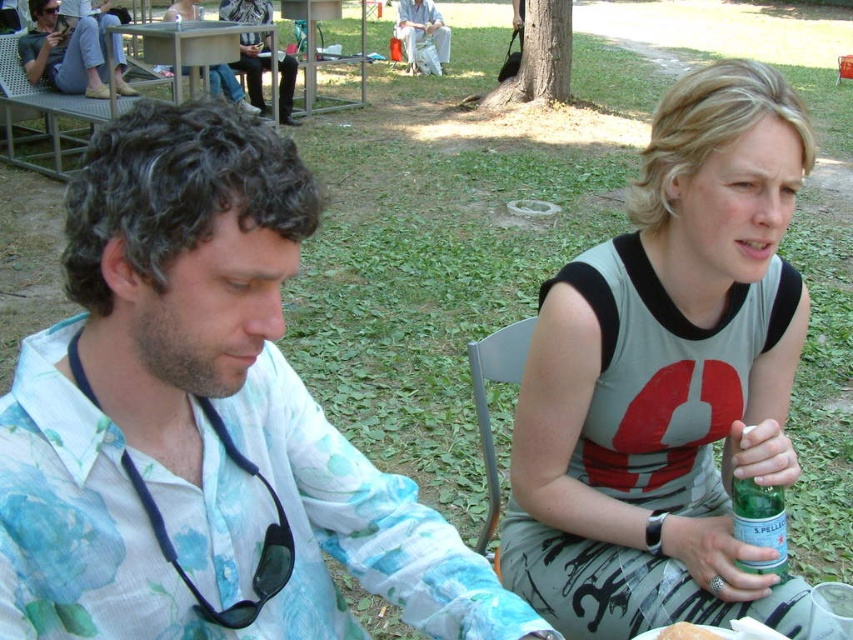
You are standing at the center of the image. There is a green glass bottle at lower right. Where exactly is the green glass bottle located in relation to the point marked at coordinates point (759, 524)?

The green glass bottle at lower right is located exactly at the point marked at coordinates point (759, 524).

You are a waiter at an outdoor cafe and need to place a new order on the table. The order includes a green glass bottle at lower right and a white fluffy bread at lower center. Which item should you place first to ensure there is enough space for both?

The green glass bottle at lower right is wider than the white fluffy bread at lower center. Therefore, you should place the green glass bottle at lower right first to ensure it has enough space on the table.

You are a photographer standing behind the two people in the scene. You want to take a photo that includes both the floral cotton shirt at left and the green glass bottle at lower right without any obstructions. What is the minimum distance you need to move backward to ensure both objects are fully visible in your camera frame?

The minimum distance you need to move backward is 58.88 centimeters to ensure both the floral cotton shirt at left and the green glass bottle at lower right are fully visible in your camera frame.